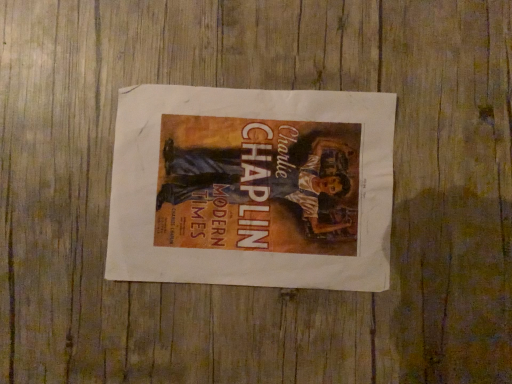
Identify the location of free space above white paper poster at center (from a real-world perspective). (247, 183).